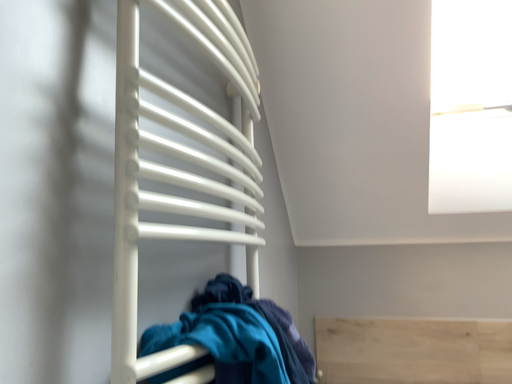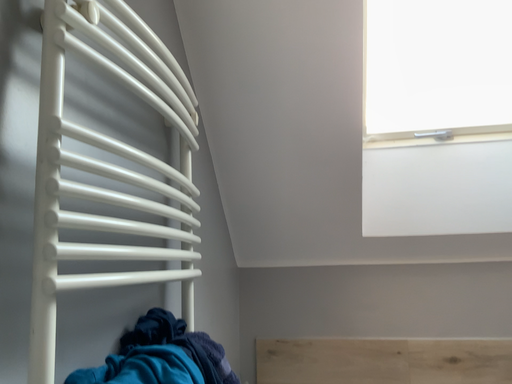
Question: How did the camera likely rotate when shooting the video?

Choices:
 (A) rotated left
 (B) rotated right

Answer: (B)